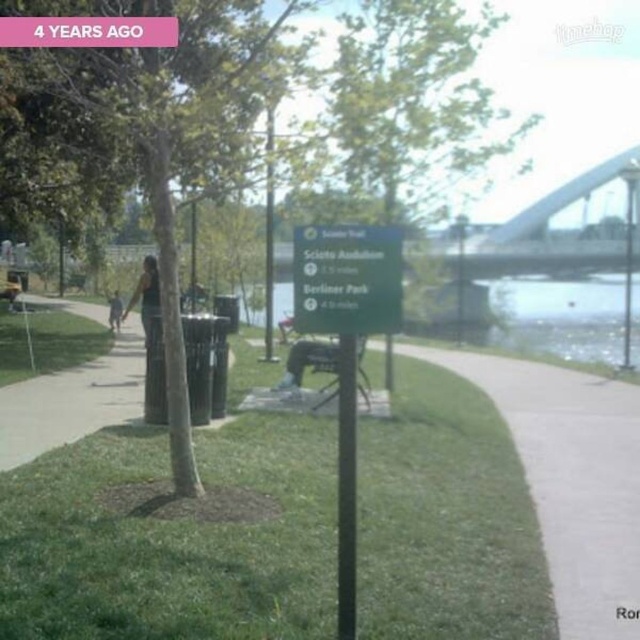
Question: In this image, where is green grass at center located relative to black fabric person at center-left?

Choices:
 (A) below
 (B) above

Answer: (A)

Question: Which point appears farthest from the camera in this image?

Choices:
 (A) (349, 244)
 (B) (554, 556)
 (C) (164, 42)
 (D) (113, 317)

Answer: (D)

Question: Is green matte signpost at center above green matte sign at center?

Choices:
 (A) no
 (B) yes

Answer: (A)

Question: Can you confirm if green matte signpost at center is smaller than black fabric person at center-left?

Choices:
 (A) yes
 (B) no

Answer: (A)

Question: Which of the following is the farthest from the observer?

Choices:
 (A) (362, 225)
 (B) (179, 300)

Answer: (B)

Question: Among these points, which one is farthest from the camera?

Choices:
 (A) (221, 90)
 (B) (292, 236)
 (C) (614, 442)

Answer: (C)